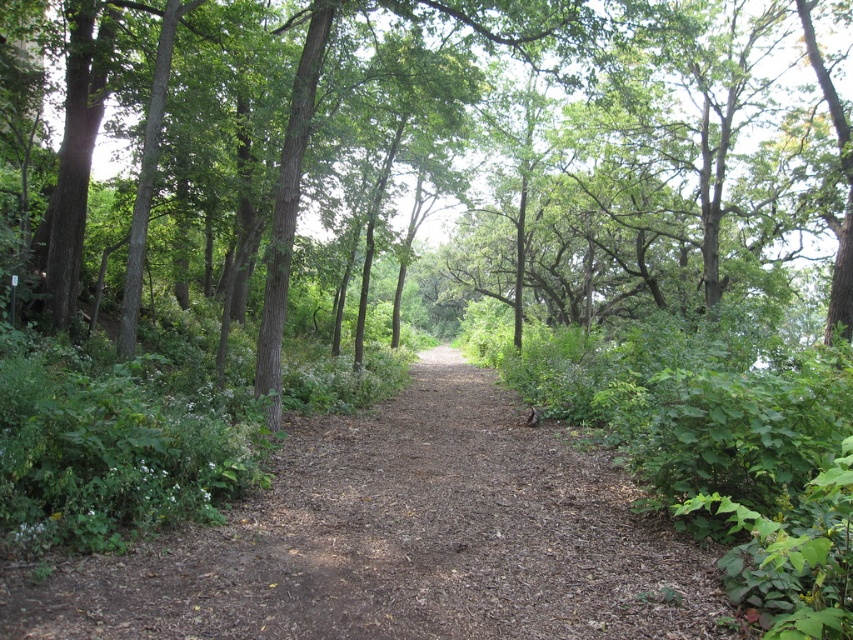
This screenshot has height=640, width=853. What do you see at coordinates (428, 161) in the screenshot?
I see `brown rough tree at center` at bounding box center [428, 161].

Between brown rough tree at center and brown dirt trail at center, which one has more height?

brown rough tree at center is taller.

Looking at this image, who is more forward, (733, 192) or (532, 506)?

Positioned in front is point (532, 506).

You are a GUI agent. You are given a task and a screenshot of the screen. Output one action in this format:
    pyautogui.click(x=<x>, y=<y>)
    Task: Click on the brown rough tree at center
    
    Given the screenshot: What is the action you would take?
    pyautogui.click(x=428, y=161)